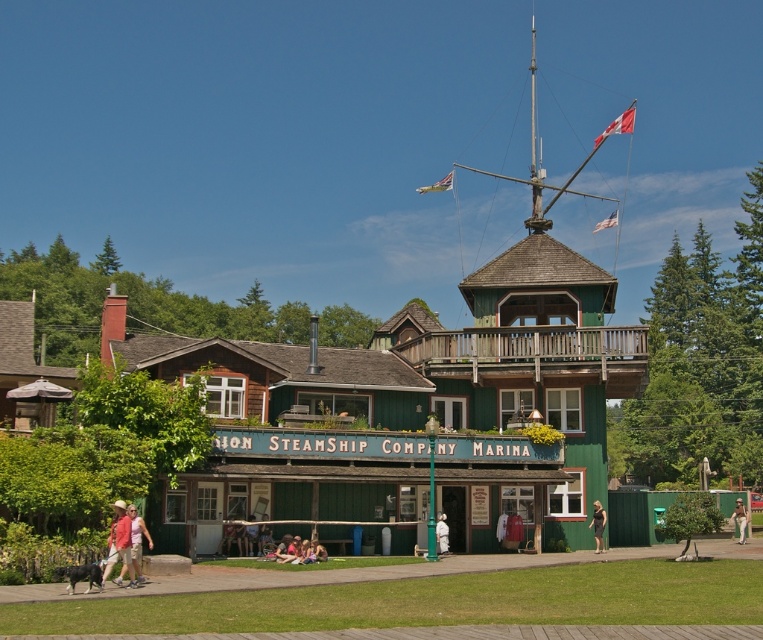
You are a photographer standing at the marina building. You have a light brown leather jacket at center and a camera. If you want to take a photo of the Canadian flag on the mast, which object should you pick up first?

You should pick up the camera first because the light brown leather jacket at center and camera are 210.75 feet apart, so the camera is farther away from you than the jacket.

You are a customer at the ION STEAMSHIP COMPANY MARINA and you see two items hanging on a rack at the center of the building. The items are the light brown leather jacket at center and the dark gray fabric dress at center. Which item is located to the left when facing the rack?

The light brown leather jacket at center is positioned on the left side of the dark gray fabric dress at center, so it is located to the left when facing the rack.

Based on the photo, you are a photographer standing at the entrance of the marina building. You notice a matte red shirt at lower left and a white cotton dress at center in your view. Which clothing item appears taller in the photo?

The matte red shirt at lower left is taller than the white cotton dress at center in the photo.